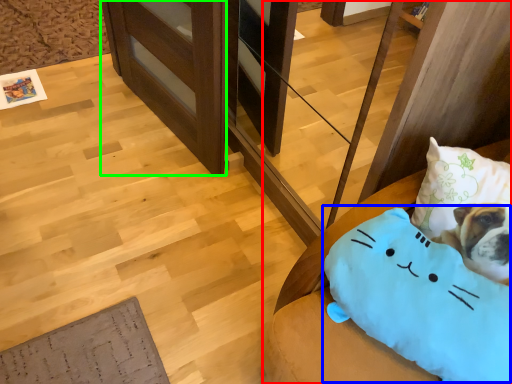
Question: Which object is the farthest from furniture (highlighted by a red box)? Choose among these: pillow (highlighted by a blue box) or shelf (highlighted by a green box).

Choices:
 (A) pillow
 (B) shelf

Answer: (B)